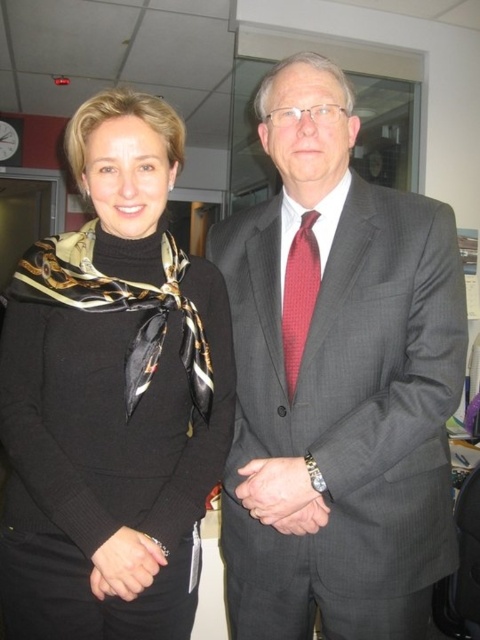
Question: Is matte gray suit at center positioned before black silk scarf at left?

Choices:
 (A) yes
 (B) no

Answer: (B)

Question: Does matte gray suit at center appear on the left side of black silk scarf at left?

Choices:
 (A) no
 (B) yes

Answer: (A)

Question: Based on their relative distances, which object is nearer to the matte gray suit at center?

Choices:
 (A) black silk scarf at left
 (B) red textured tie at center

Answer: (B)

Question: Estimate the real-world distances between objects in this image. Which object is farther from the matte gray suit at center?

Choices:
 (A) red textured tie at center
 (B) black silk scarf at left

Answer: (B)

Question: Estimate the real-world distances between objects in this image. Which object is farther from the red textured tie at center?

Choices:
 (A) matte gray suit at center
 (B) black silk scarf at left

Answer: (B)

Question: Is matte gray suit at center in front of red textured tie at center?

Choices:
 (A) no
 (B) yes

Answer: (B)